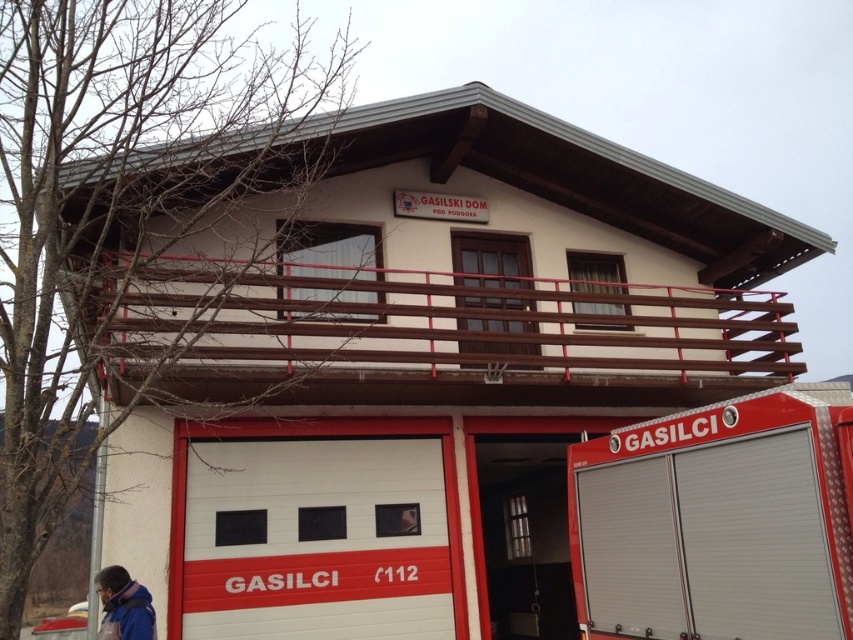
Question: Is the position of metallic silver fire truck at lower right more distant than that of blue fabric jacket at lower left?

Choices:
 (A) yes
 (B) no

Answer: (B)

Question: Can you confirm if metallic silver fire truck at lower right is positioned to the left of blue fabric jacket at lower left?

Choices:
 (A) no
 (B) yes

Answer: (A)

Question: Which of the following is the closest to the observer?

Choices:
 (A) metallic silver fire truck at lower right
 (B) blue fabric jacket at lower left

Answer: (A)

Question: Which point appears farthest from the camera in this image?

Choices:
 (A) (585, 630)
 (B) (143, 628)

Answer: (A)

Question: Is metallic silver fire truck at lower right smaller than blue fabric jacket at lower left?

Choices:
 (A) yes
 (B) no

Answer: (B)

Question: Which of the following is the farthest from the observer?

Choices:
 (A) (136, 604)
 (B) (666, 604)

Answer: (A)